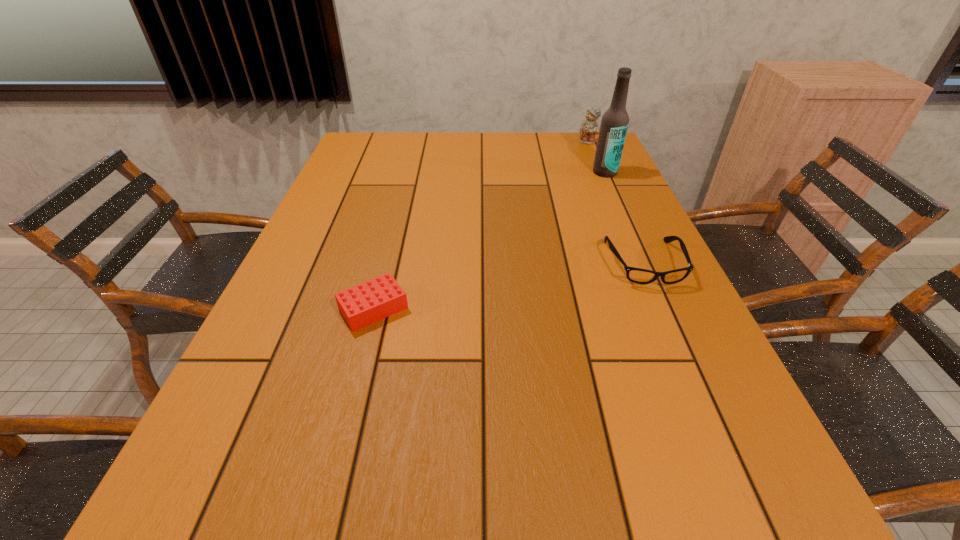
This screenshot has height=540, width=960. In order to click on free region located 0.400m on the side of the beer bottle with the label in this screenshot , I will do `click(565, 248)`.

This screenshot has height=540, width=960. I want to click on free point located on the front-facing side of the farthest object, so click(x=571, y=167).

The height and width of the screenshot is (540, 960). I want to click on vacant space located 0.060m on the front-facing side of the farthest object, so click(x=581, y=152).

You are a GUI agent. You are given a task and a screenshot of the screen. Output one action in this format:
    pyautogui.click(x=<x>, y=<y>)
    Task: Click on the free space located 0.320m on the front-facing side of the farthest object
    The height and width of the screenshot is (540, 960).
    Given the screenshot: What is the action you would take?
    pyautogui.click(x=560, y=187)

Locate an element on the screen. This screenshot has height=540, width=960. object that is positioned at the far edge is located at coordinates (589, 128).

Find the location of a particular element. object present at the left edge is located at coordinates click(366, 303).

Locate an element on the screen. Image resolution: width=960 pixels, height=540 pixels. spectacles that is positioned at the right edge is located at coordinates (636, 275).

Image resolution: width=960 pixels, height=540 pixels. I want to click on beer bottle situated at the right edge, so click(614, 124).

I want to click on teddy bear located at the right edge, so click(589, 128).

Locate an element on the screen. This screenshot has height=540, width=960. object located in the far right corner section of the desktop is located at coordinates (589, 128).